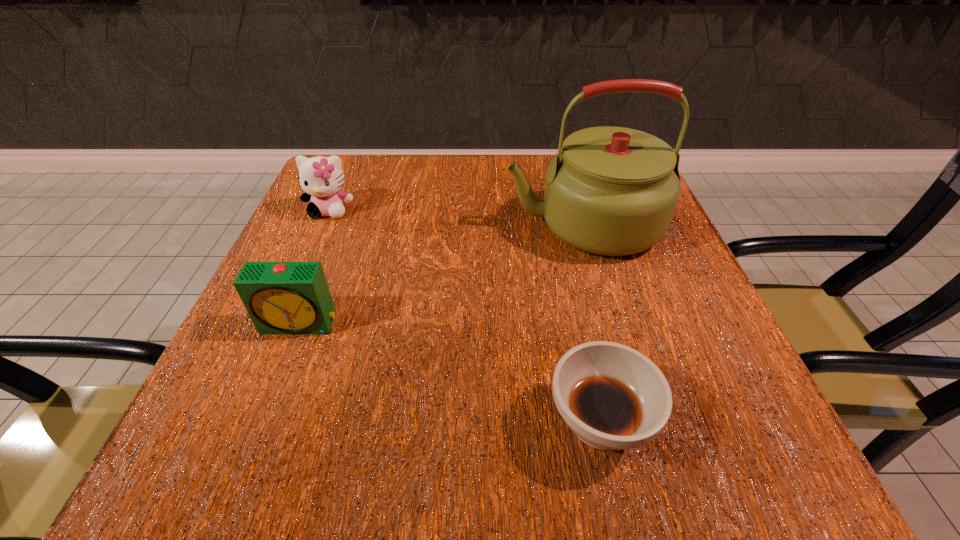
Identify the location of vacant area located on the right of the soup bowl. This screenshot has height=540, width=960. (732, 422).

Locate an element on the screen. Image resolution: width=960 pixels, height=540 pixels. kettle present at the far edge is located at coordinates (612, 191).

Identify the location of kitten situated at the far edge. (321, 178).

The width and height of the screenshot is (960, 540). I want to click on object that is at the near edge, so click(613, 397).

You are a GUI agent. You are given a task and a screenshot of the screen. Output one action in this format:
    pyautogui.click(x=<x>, y=<y>)
    Task: Click on the kitten situated at the left edge
    The height and width of the screenshot is (540, 960).
    Given the screenshot: What is the action you would take?
    pyautogui.click(x=321, y=178)

Find the location of `alarm clock that is at the left edge`. alarm clock that is at the left edge is located at coordinates (280, 297).

You are a GUI agent. You are given a task and a screenshot of the screen. Output one action in this format:
    pyautogui.click(x=<x>, y=<y>)
    Task: Click on the kettle that is positioned at the right edge
    
    Given the screenshot: What is the action you would take?
    pyautogui.click(x=612, y=191)

Identify the location of soup bowl at the right edge. (613, 397).

This screenshot has height=540, width=960. What are the coordinates of `object that is positioned at the far left corner` in the screenshot? It's located at (321, 178).

The height and width of the screenshot is (540, 960). I want to click on object at the far right corner, so click(612, 191).